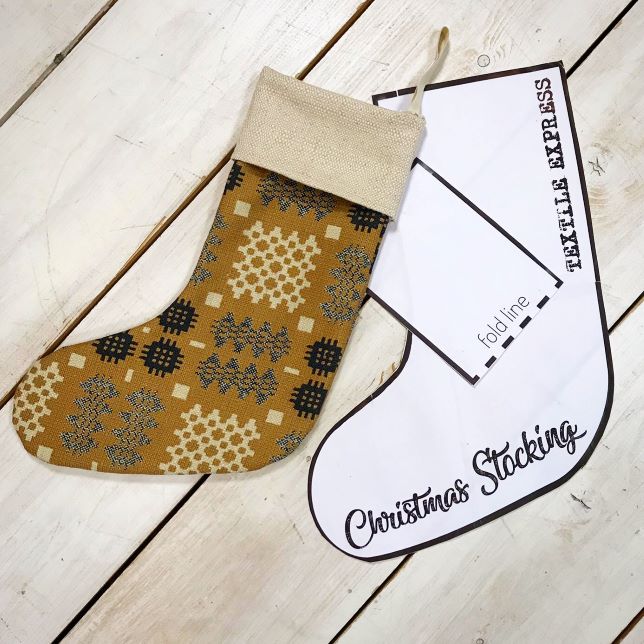
The image size is (644, 644). What are the coordinates of `wooden board` in the screenshot? It's located at (218, 556).